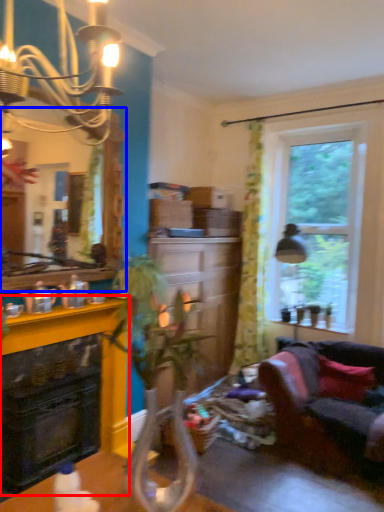
Question: Which object appears closest to the camera in this image, fireplace (highlighted by a red box) or mirror (highlighted by a blue box)?

Choices:
 (A) fireplace
 (B) mirror

Answer: (B)